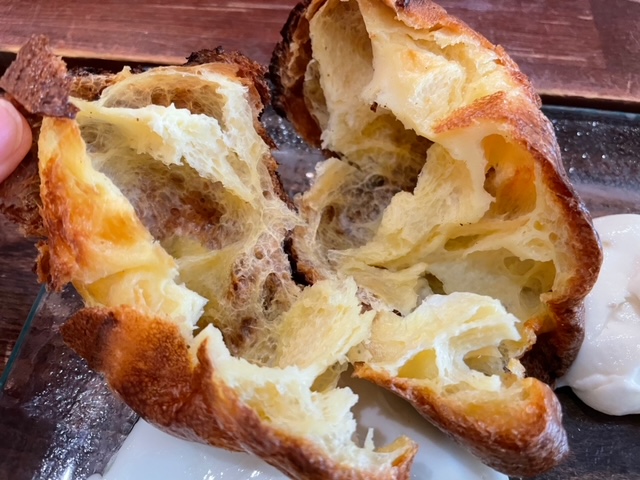
Where is `surface`? This screenshot has width=640, height=480. surface is located at coordinates (596, 158).